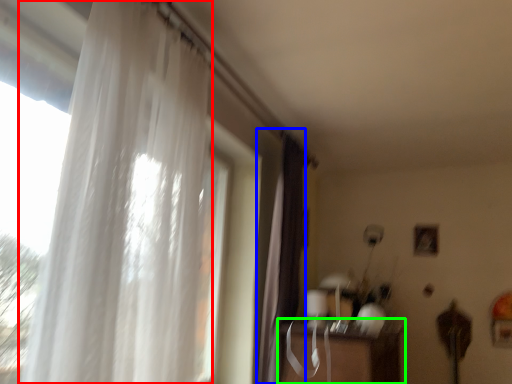
Question: Considering the real-world distances, which object is closest to curtain (highlighted by a red box)? curtain (highlighted by a blue box) or table (highlighted by a green box).

Choices:
 (A) curtain
 (B) table

Answer: (A)